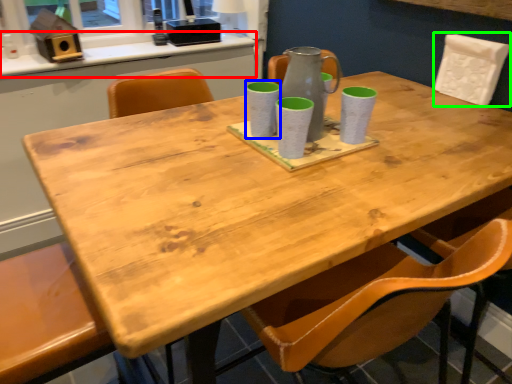
Question: Based on their relative distances, which object is farther from counter top (highlighted by a red box)? Choose from mug (highlighted by a blue box) and chair (highlighted by a green box).

Choices:
 (A) mug
 (B) chair

Answer: (B)